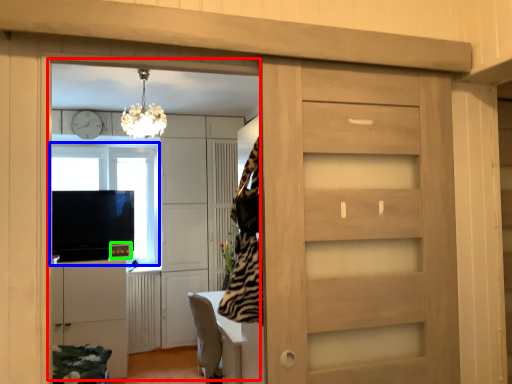
Question: Estimate the real-world distances between objects in this image. Which object is farther from entertainment center (highlighted by a red box), window (highlighted by a blue box) or appliance (highlighted by a green box)?

Choices:
 (A) window
 (B) appliance

Answer: (B)